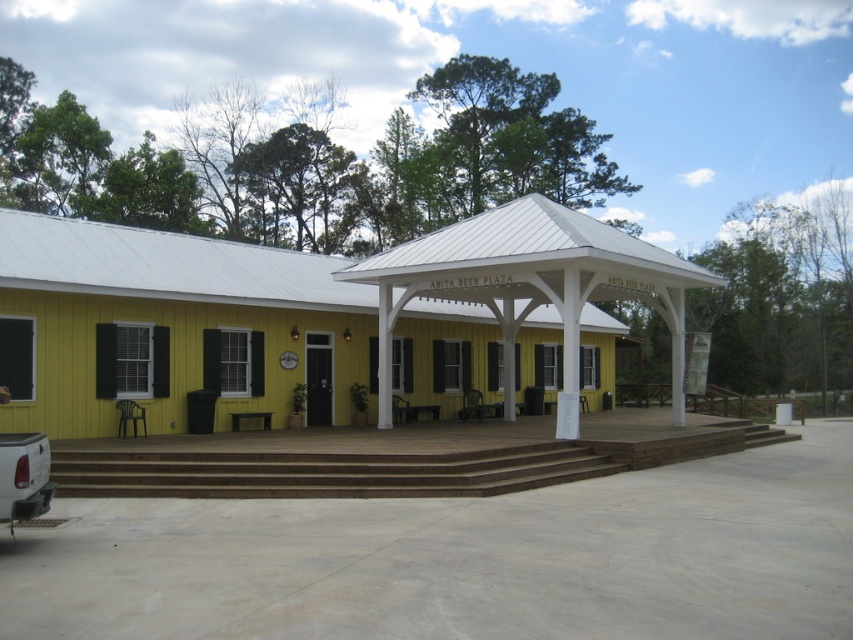
Who is taller, brown wooden porch at center or brown wooden stairs at center?

brown wooden porch at center is taller.

Which is behind, point (242, 477) or point (437, 480)?

The point (242, 477) is more distant.

Is point (430, 444) positioned after point (254, 474)?

Yes, it is behind point (254, 474).

You are a GUI agent. You are given a task and a screenshot of the screen. Output one action in this format:
    pyautogui.click(x=<x>, y=<y>)
    Task: Click on the brown wooden porch at center
    Image resolution: width=853 pixels, height=640 pixels.
    Given the screenshot: What is the action you would take?
    pyautogui.click(x=395, y=458)